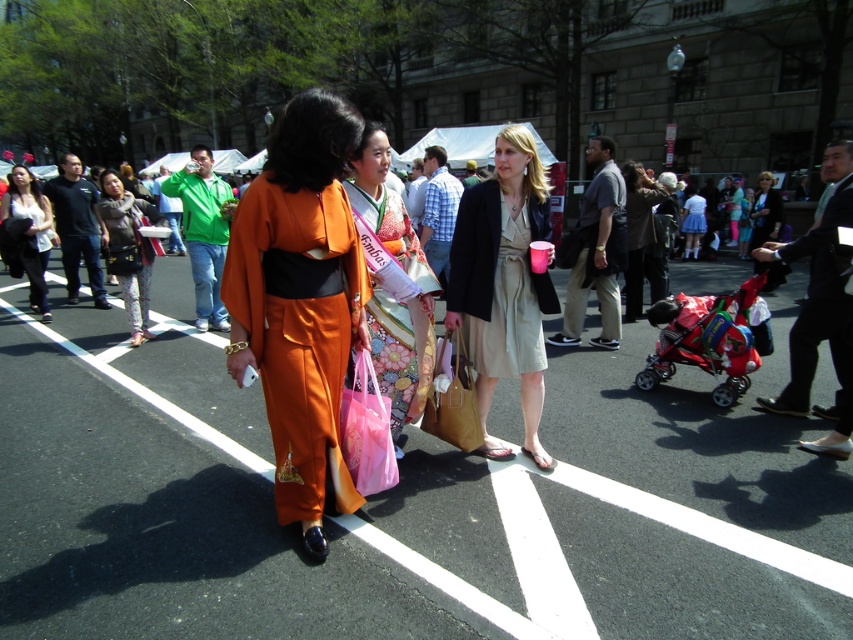
Consider the image. You are an artist trying to sketch the scene. You notice the orange silk kimono at center and the matte black purse at center. Which object should you draw first if you want to start with the narrower one?

The orange silk kimono at center has a lesser width compared to the matte black purse at center, so you should draw the orange silk kimono at center first.

You are a photographer trying to capture a photo of the matte beige dress at center and the red plastic baby carriage at lower right. Based on their positions, which object is higher in the image?

The matte beige dress at center is higher than the red plastic baby carriage at lower right.

You are a photographer standing in the middle of the street. You want to take a photo of the red plastic baby carriage at lower right and the matte black jacket at left. Which object is closer to you?

The red plastic baby carriage at lower right is closer to you since it is in front of the matte black jacket at left.